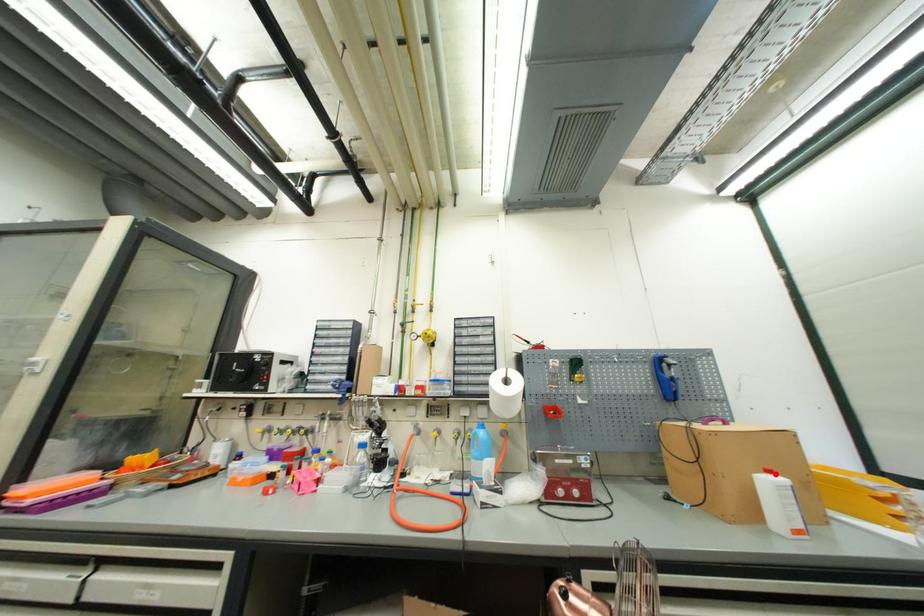
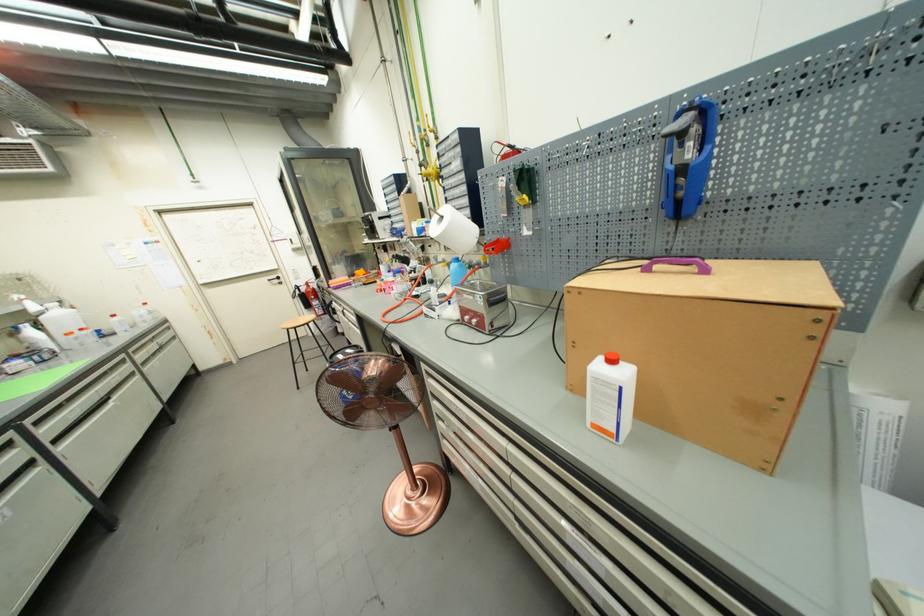
Question: I am providing you with two images of the same scene from different viewpoints. A red point is marked on the first image. Is the red point's position out of view in image 2?

Choices:
 (A) Yes
 (B) No

Answer: (B)